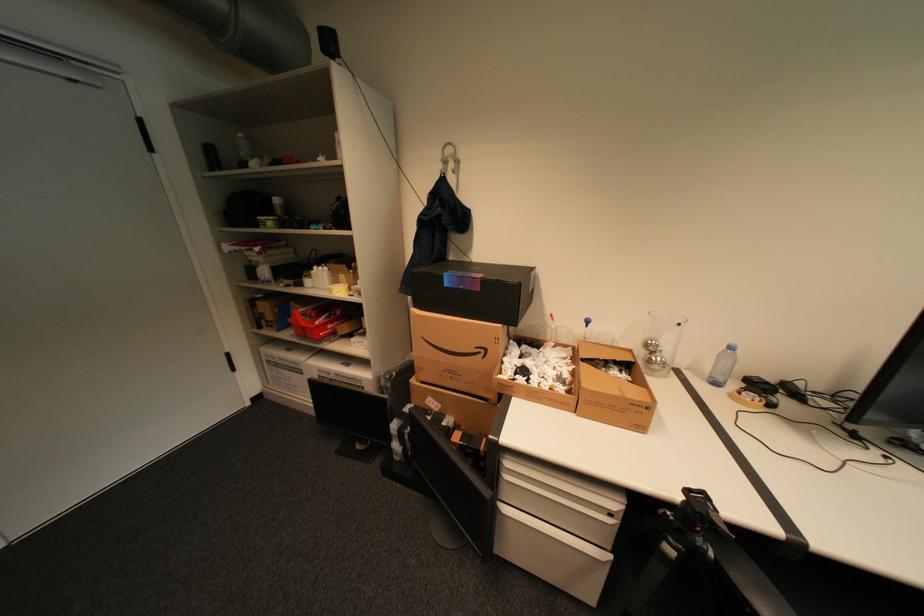
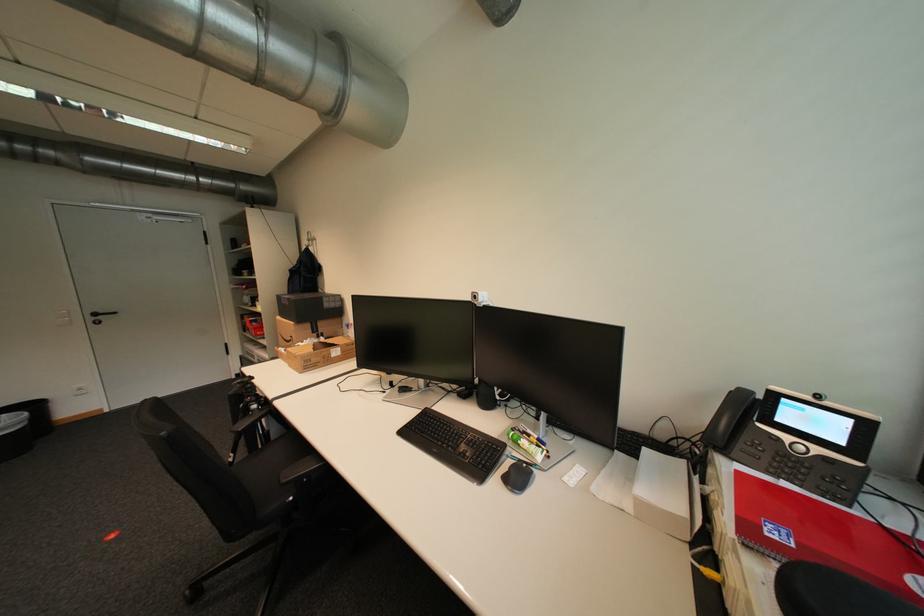
The point at (x=484, y=349) is marked in the first image. Where is the corresponding point in the second image?

(299, 338)